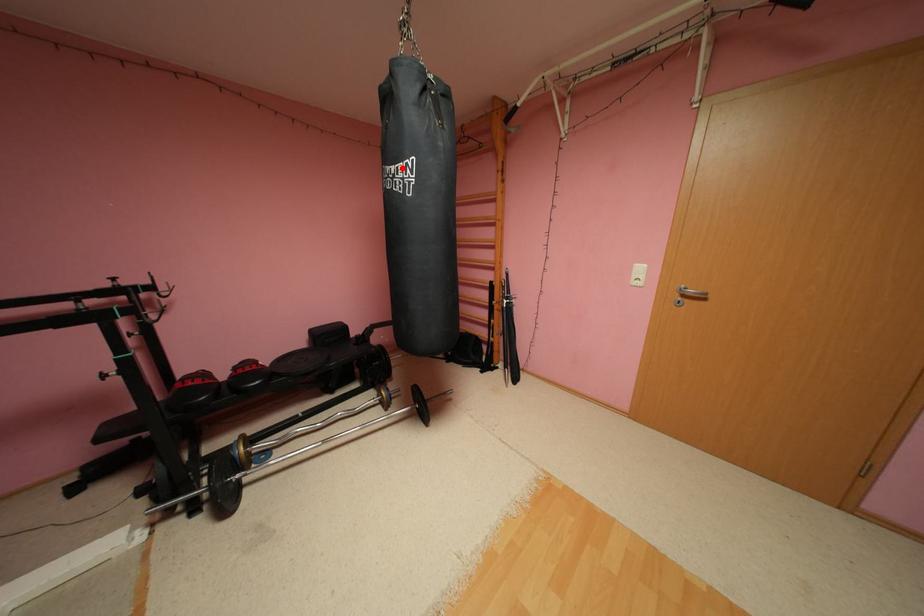
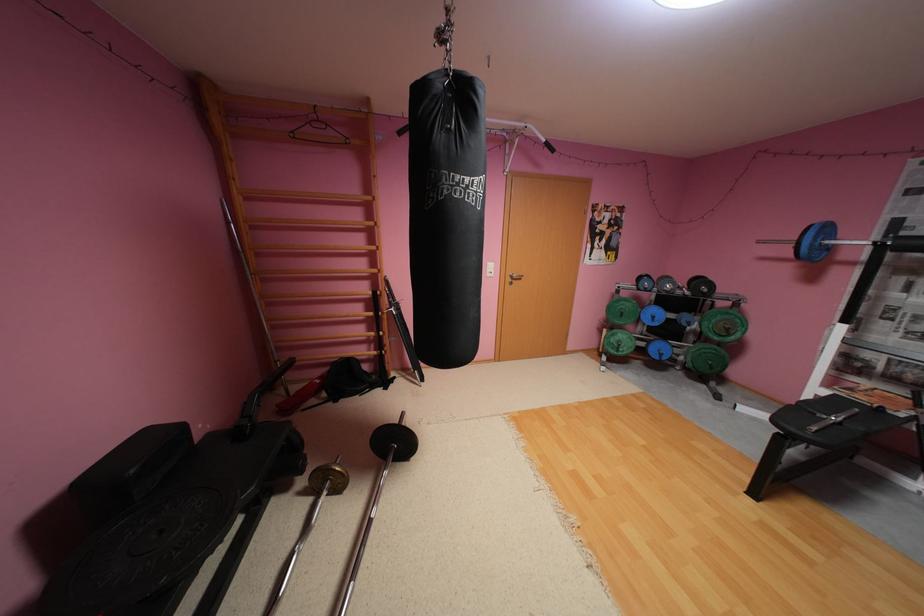
Question: I am providing you with two images of the same scene from different viewpoints. A red point is marked on the first image. At the location where the point appears in image 1, is it still visible in image 2?

Choices:
 (A) Yes
 (B) No

Answer: (A)